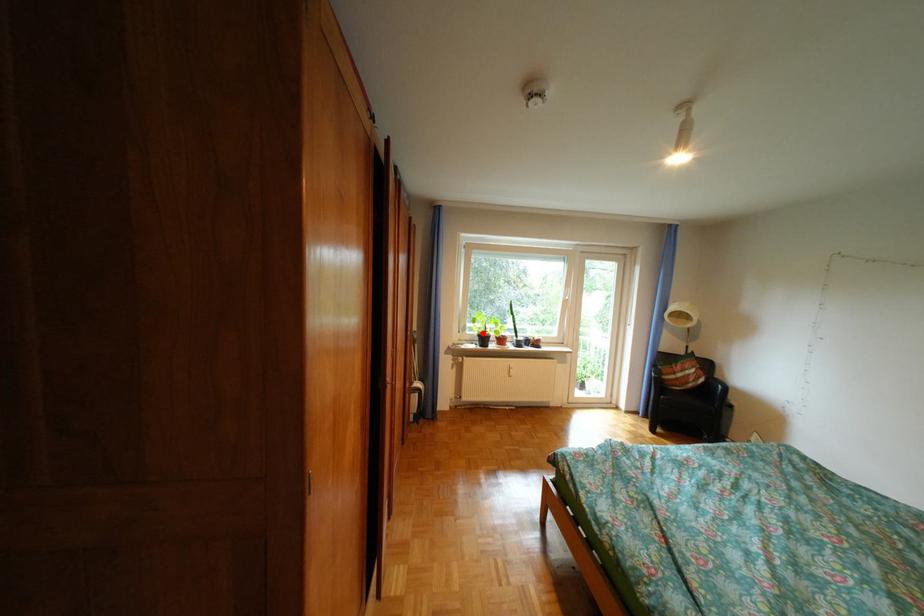
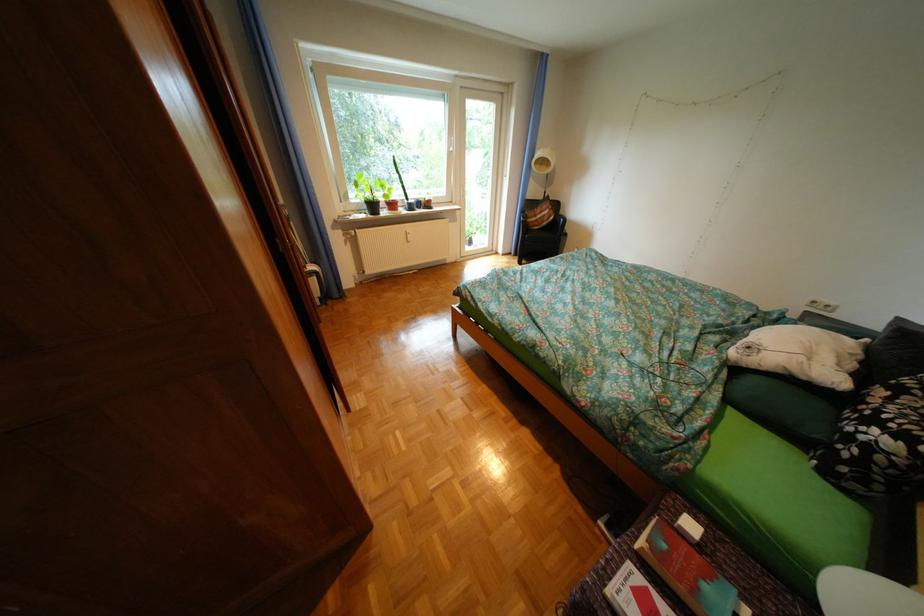
Question: I am providing you with two images of the same scene from different viewpoints. A red point is marked on the first image. Can you still see the location of the red point in image 2?

Choices:
 (A) Yes
 (B) No

Answer: (A)